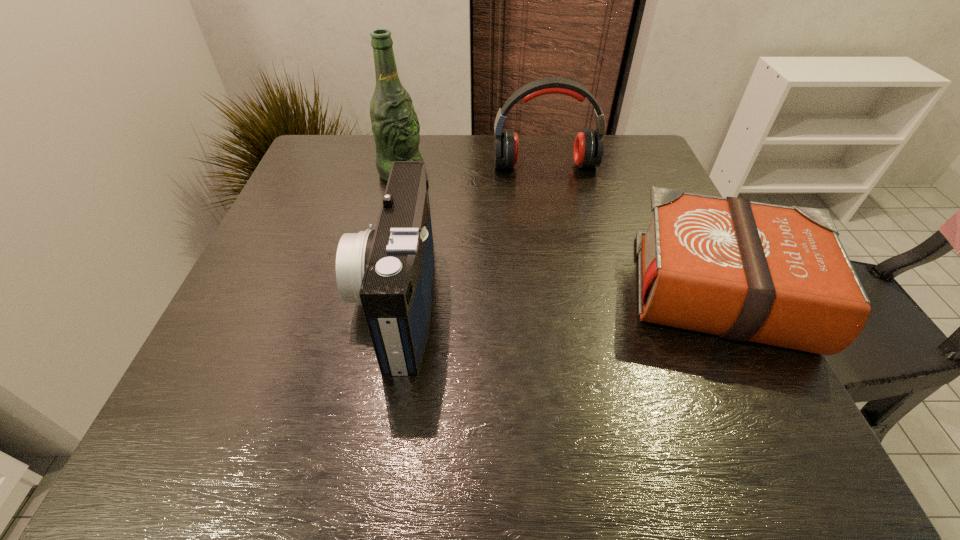
The width and height of the screenshot is (960, 540). In order to click on free space located 0.110m on the surface of the tallest object in this screenshot , I will do `click(446, 200)`.

The width and height of the screenshot is (960, 540). I want to click on free location located on the ear cups of the earphone, so (x=560, y=230).

Image resolution: width=960 pixels, height=540 pixels. Find the location of `vacant space situated 0.090m on the ear cups of the earphone`. vacant space situated 0.090m on the ear cups of the earphone is located at coordinates (553, 198).

Locate an element on the screen. Image resolution: width=960 pixels, height=540 pixels. vacant region located 0.370m on the ear cups of the earphone is located at coordinates (572, 284).

This screenshot has height=540, width=960. I want to click on beer bottle that is at the far edge, so click(x=395, y=126).

Where is `earphone present at the far edge`? The width and height of the screenshot is (960, 540). earphone present at the far edge is located at coordinates pos(588,148).

This screenshot has height=540, width=960. I want to click on camcorder located in the near edge section of the desktop, so click(x=390, y=270).

The height and width of the screenshot is (540, 960). I want to click on Bible present at the near edge, so click(747, 271).

Where is `Bible at the right edge`? This screenshot has height=540, width=960. Bible at the right edge is located at coordinates (747, 271).

Where is `earphone that is at the right edge`? The width and height of the screenshot is (960, 540). earphone that is at the right edge is located at coordinates (588, 148).